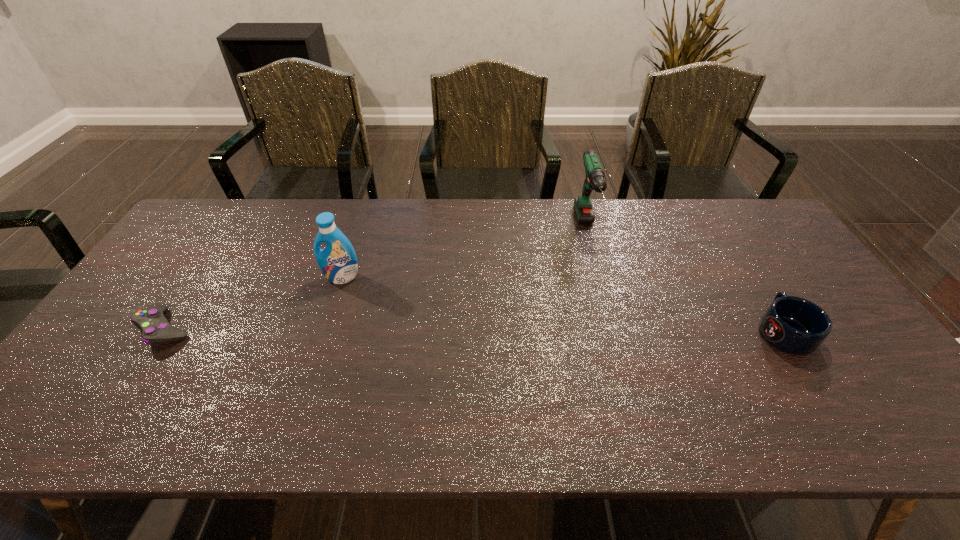
Locate an element on the screen. The height and width of the screenshot is (540, 960). vacant region at the far left corner is located at coordinates (227, 200).

Locate an element on the screen. free space at the near left corner of the desktop is located at coordinates (38, 437).

This screenshot has width=960, height=540. I want to click on free area in between the shortest object and the third object from left to right, so click(x=375, y=278).

I want to click on empty space that is in between the farthest object and the third tallest object, so click(685, 279).

The image size is (960, 540). What are the coordinates of `free spot between the third object from left to right and the third tallest object` in the screenshot? It's located at (685, 279).

I want to click on unoccupied position between the second shortest object and the drill, so click(x=685, y=279).

Locate an element on the screen. empty location between the third object from left to right and the detergent is located at coordinates [465, 252].

Locate an element on the screen. Image resolution: width=960 pixels, height=540 pixels. blank region between the detergent and the farthest object is located at coordinates (465, 252).

The height and width of the screenshot is (540, 960). Find the location of `free spot between the second shortest object and the leftmost object`. free spot between the second shortest object and the leftmost object is located at coordinates (474, 330).

Identify the location of free space between the drill and the second shortest object. (685, 279).